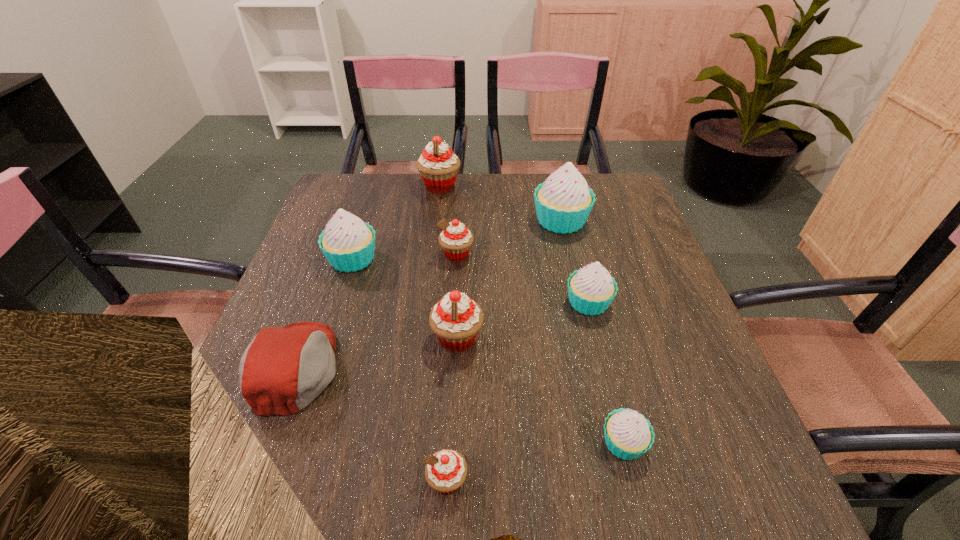
The image size is (960, 540). I want to click on vacant space that's between the third nearest pink cupcake and the cap, so pos(376,311).

This screenshot has height=540, width=960. Identify the location of vacant space that is in between the cap and the third biggest pink cupcake. (376, 311).

Identify the location of free space between the leftmost white cupcake and the second farthest pink cupcake. The height and width of the screenshot is (540, 960). (404, 256).

The width and height of the screenshot is (960, 540). I want to click on free spot between the second smallest pink cupcake and the third nearest white cupcake, so click(x=404, y=256).

At what (x,y) coordinates should I click in order to perform the action: click on vacant area that lies between the cap and the farthest object. Please return your answer as a coordinate pair (x, y). The image size is (960, 540). Looking at the image, I should click on (369, 277).

This screenshot has width=960, height=540. I want to click on free space that is in between the leftmost white cupcake and the second biggest pink cupcake, so click(x=405, y=299).

At what (x,y) coordinates should I click in order to perform the action: click on free space between the smallest white cupcake and the third biggest pink cupcake. Please return your answer as a coordinate pair (x, y). The width and height of the screenshot is (960, 540). Looking at the image, I should click on (540, 348).

At what (x,y) coordinates should I click in order to perform the action: click on vacant area that lies between the third biggest white cupcake and the biggest white cupcake. Please return your answer as a coordinate pair (x, y). The width and height of the screenshot is (960, 540). Looking at the image, I should click on (575, 261).

I want to click on free space between the leftmost white cupcake and the nearest white cupcake, so click(488, 351).

Where is `blank region between the third nearest pink cupcake and the red cap`? Image resolution: width=960 pixels, height=540 pixels. blank region between the third nearest pink cupcake and the red cap is located at coordinates (376, 311).